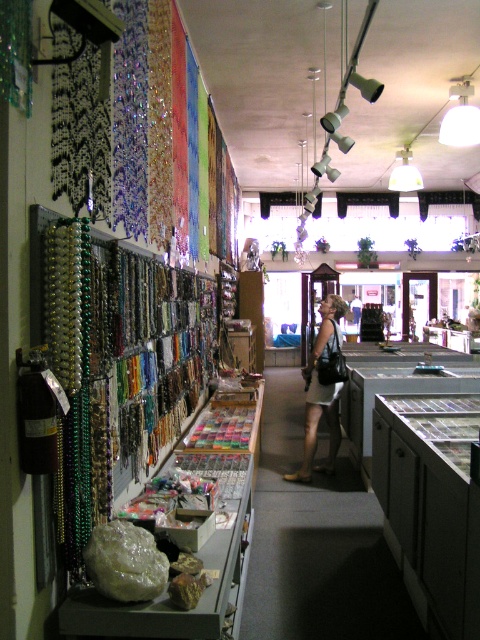
You are a customer in the jewelry store and want to buy the green matte beads at left and the leather skirt at center. The store has a policy that items must be purchased in the order they are arranged from left to right. Which item should you purchase first?

The green matte beads at left should be purchased first since they are positioned to the left of the leather skirt at center, following the store policy of purchasing items from left to right.

You are standing in the jewelry store and want to locate two specific points marked in the image. The first point is at coordinates point (172, 330) and the second is at point (323, 316). Which point is closer to you?

Point (172, 330) is closer to the viewer than point (323, 316).